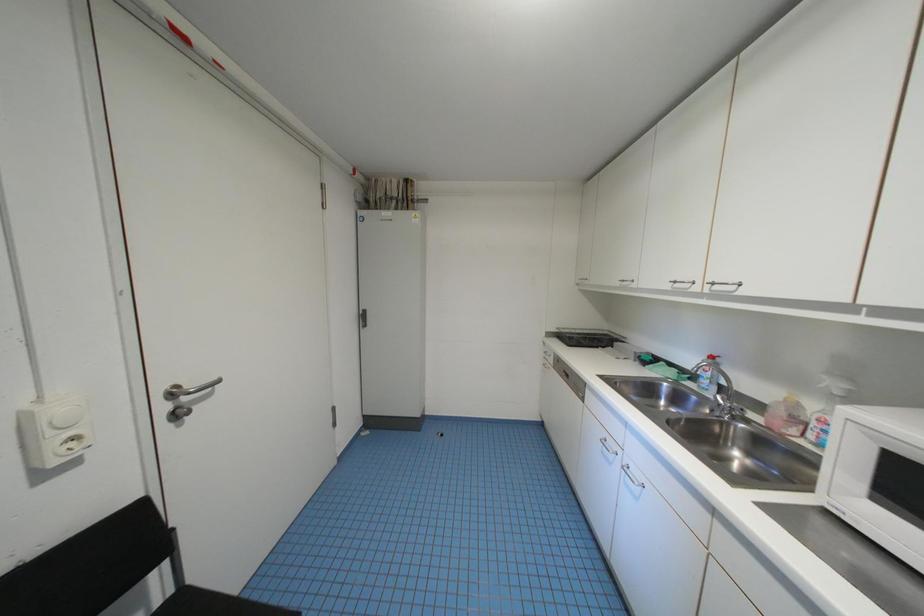
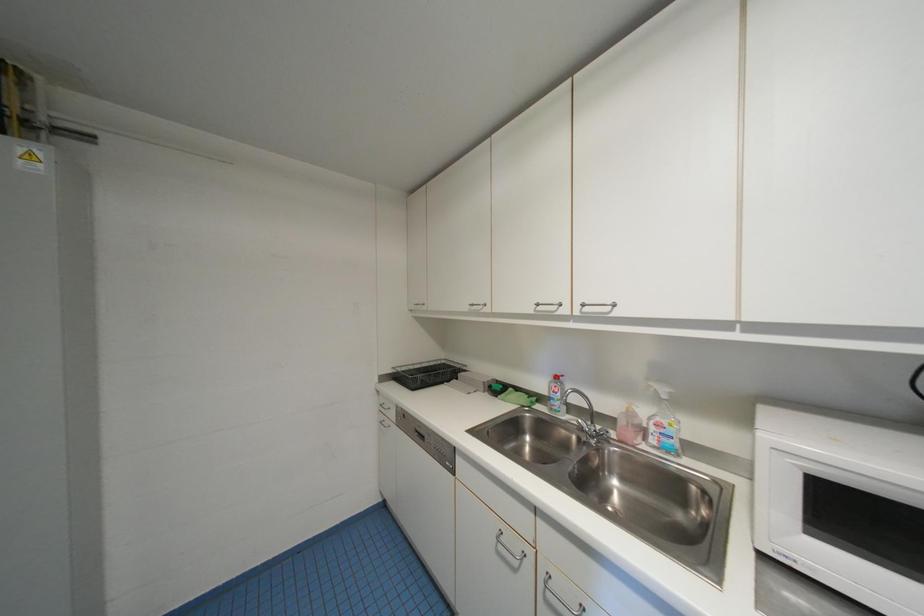
Question: How did the camera likely rotate?

Choices:
 (A) Left
 (B) Right
 (C) Up
 (D) Down

Answer: (B)